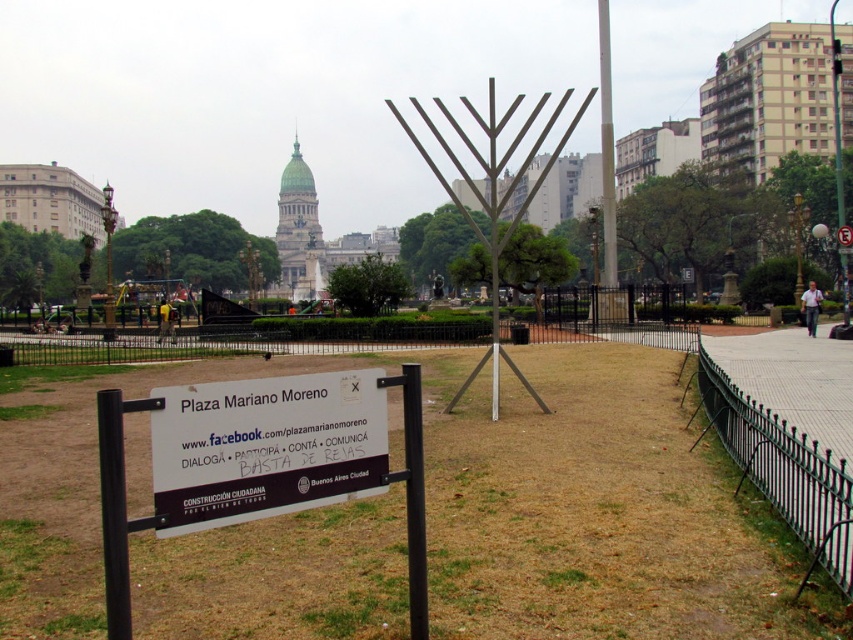
You are a tourist in Plaza Mariano Moreno and want to take a photo of the white glossy pole at upper center with the black wrought iron fence at right in the background. Can you position yourself in a way that both are visible in the frame?

Yes, you can position yourself to the right of both the black wrought iron fence at right and the white glossy pole at upper center so that the black wrought iron fence at right is behind the white glossy pole at upper center, making both visible in the frame.

You are a city planner assessing the layout of Plaza Mariano Moreno. You need to install a new bench between the black wrought iron fence at right and the metallic silver menorah at center. What is the minimum distance the bench should be placed from each object to ensure it is equidistant from both?

The bench should be placed exactly halfway between the black wrought iron fence at right and the metallic silver menorah at center. Since they are 70.03 meters apart, the midpoint would be at 35.015 meters from each object.

You are a photographer planning to take a photo of the Plaza Mariano Moreno sign and the menorah structure. You want to ensure both the sign and the menorah are clearly visible in the frame. Given the spatial relationship between the black wrought iron fence at right and the white glossy pole at upper center, what should you do to avoid obstruction?

Since the black wrought iron fence at right is in front of the white glossy pole at upper center, you should position yourself so that the fence does not block the view of the menorah structure behind it. Move to the left side to ensure both the sign and the menorah are visible without obstruction.